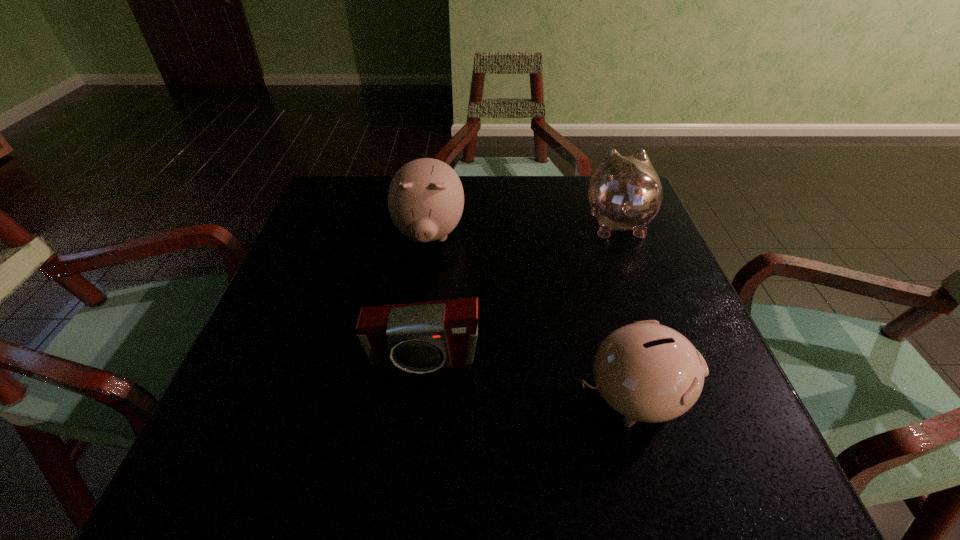
You are a GUI agent. You are given a task and a screenshot of the screen. Output one action in this format:
    pyautogui.click(x=<x>, y=<y>)
    Task: Click on the free space at the near edge of the desktop
    
    Given the screenshot: What is the action you would take?
    pyautogui.click(x=557, y=465)

Where is `free space at the left edge of the desktop`? This screenshot has height=540, width=960. free space at the left edge of the desktop is located at coordinates (297, 428).

In the image, there is a desktop. Where is `free region at the right edge`? The height and width of the screenshot is (540, 960). free region at the right edge is located at coordinates (683, 310).

Identify the location of free space at the near left corner of the desktop. The image size is (960, 540). (209, 454).

In the image, there is a desktop. In order to click on vacant area at the near right corner in this screenshot , I will do `click(686, 444)`.

Where is `blank region between the camera and the leftmost piggy bank`? The height and width of the screenshot is (540, 960). blank region between the camera and the leftmost piggy bank is located at coordinates (426, 299).

You are a GUI agent. You are given a task and a screenshot of the screen. Output one action in this format:
    pyautogui.click(x=<x>, y=<y>)
    Task: Click on the free space that is in between the leftmost piggy bank and the camera
    
    Given the screenshot: What is the action you would take?
    pyautogui.click(x=426, y=299)

Where is `free space between the camera and the leftmost piggy bank`? The width and height of the screenshot is (960, 540). free space between the camera and the leftmost piggy bank is located at coordinates (426, 299).

The width and height of the screenshot is (960, 540). What are the coordinates of `free space that is in between the leftmost piggy bank and the shortest piggy bank` in the screenshot? It's located at (531, 316).

Where is `unoccupied position between the leftmost piggy bank and the nearest piggy bank`? This screenshot has width=960, height=540. unoccupied position between the leftmost piggy bank and the nearest piggy bank is located at coordinates (531, 316).